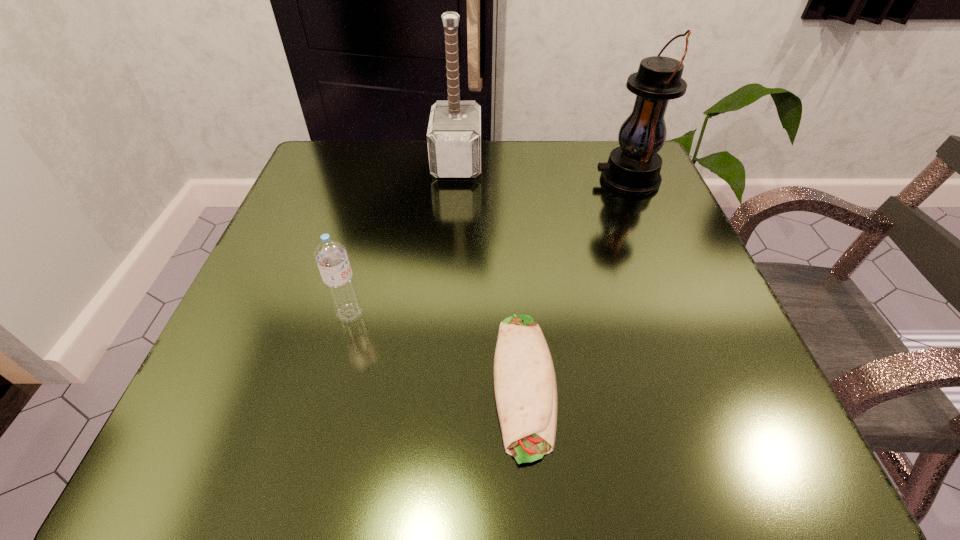
Locate an element on the screen. The image size is (960, 540). the third object from right to left is located at coordinates (454, 132).

Find the location of a particular element. The height and width of the screenshot is (540, 960). the rightmost object is located at coordinates (633, 168).

You are a GUI agent. You are given a task and a screenshot of the screen. Output one action in this format:
    pyautogui.click(x=<x>, y=<y>)
    Task: Click on the leftmost object
    The image size is (960, 540).
    Given the screenshot: What is the action you would take?
    pyautogui.click(x=330, y=255)

You are a GUI agent. You are given a task and a screenshot of the screen. Output one action in this format:
    pyautogui.click(x=<x>, y=<y>)
    Task: Click on the second shortest object
    
    Given the screenshot: What is the action you would take?
    pyautogui.click(x=330, y=255)

Locate an element on the screen. Image resolution: width=960 pixels, height=540 pixels. the shortest object is located at coordinates (525, 386).

Identify the location of burrito. (525, 386).

Locate an element on the screen. This screenshot has width=960, height=540. free space located for striking with the head of the hammer is located at coordinates (547, 162).

Locate the blank area located above the lantern, indicating its light source in the image. Please provide its 2D coordinates. Your answer should be formatted as a tuple, i.e. [(x, y)], where the tuple contains the x and y coordinates of a point satisfying the conditions above.

[(572, 179)]

Point to a free spot located above the lantern, indicating its light source. Please provide its 2D coordinates. Your answer should be formatted as a tuple, i.e. [(x, y)], where the tuple contains the x and y coordinates of a point satisfying the conditions above.

[(462, 179)]

Locate several points within the vacant space positioned above the lantern, indicating its light source. Please provide its 2D coordinates. Your answer should be formatted as a tuple, i.e. [(x, y)], where the tuple contains the x and y coordinates of a point satisfying the conditions above.

[(471, 179)]